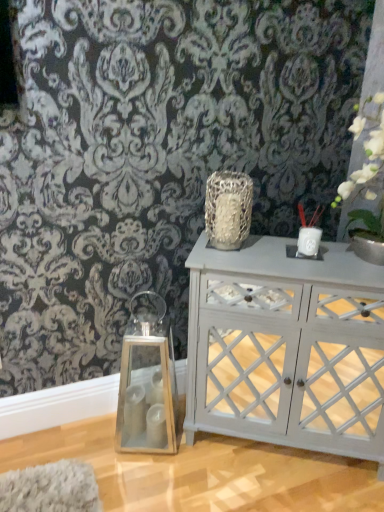
Question: From the image's perspective, is textured silver vase at center over white painted wood cabinet at center?

Choices:
 (A) yes
 (B) no

Answer: (A)

Question: Considering the relative sizes of textured silver vase at center and white painted wood cabinet at center in the image provided, is textured silver vase at center taller than white painted wood cabinet at center?

Choices:
 (A) yes
 (B) no

Answer: (B)

Question: Is textured silver vase at center not near white painted wood cabinet at center?

Choices:
 (A) no
 (B) yes

Answer: (A)

Question: Does textured silver vase at center have a greater width compared to white painted wood cabinet at center?

Choices:
 (A) yes
 (B) no

Answer: (B)

Question: From a real-world perspective, is textured silver vase at center over white painted wood cabinet at center?

Choices:
 (A) no
 (B) yes

Answer: (B)

Question: Is point (362, 109) positioned closer to the camera than point (316, 231)?

Choices:
 (A) farther
 (B) closer

Answer: (A)

Question: Is white matte vase at upper right taller or shorter than white ceramic candle holder at upper right, positioned as the 2th candle holder in right-to-left order?

Choices:
 (A) short
 (B) tall

Answer: (B)

Question: From the image's perspective, is white matte vase at upper right located above or below white ceramic candle holder at upper right, which ranks as the second candle holder in top-to-bottom order?

Choices:
 (A) below
 (B) above

Answer: (B)

Question: From a real-world perspective, relative to white ceramic candle holder at upper right, which ranks as the second candle holder in top-to-bottom order, is white matte vase at upper right vertically above or below?

Choices:
 (A) above
 (B) below

Answer: (A)

Question: Is white ceramic candle holder at upper right, positioned as the 2th candle holder in right-to-left order, wider or thinner than white painted wood cabinet at center?

Choices:
 (A) wide
 (B) thin

Answer: (B)

Question: Considering the positions of white ceramic candle holder at upper right, arranged as the second candle holder when viewed from the left, and white painted wood cabinet at center in the image, is white ceramic candle holder at upper right, arranged as the second candle holder when viewed from the left, taller or shorter than white painted wood cabinet at center?

Choices:
 (A) tall
 (B) short

Answer: (B)

Question: From a real-world perspective, is white ceramic candle holder at upper right, which ranks as the second candle holder in top-to-bottom order, above or below white painted wood cabinet at center?

Choices:
 (A) below
 (B) above

Answer: (B)

Question: Considering the positions of point (312, 242) and point (248, 311), is point (312, 242) closer or farther from the camera than point (248, 311)?

Choices:
 (A) farther
 (B) closer

Answer: (A)

Question: Considering the positions of point pos(367,138) and point pos(192,430), is point pos(367,138) closer or farther from the camera than point pos(192,430)?

Choices:
 (A) farther
 (B) closer

Answer: (A)

Question: In the image, is white matte vase at upper right positioned in front of or behind white painted wood cabinet at center?

Choices:
 (A) behind
 (B) front

Answer: (B)